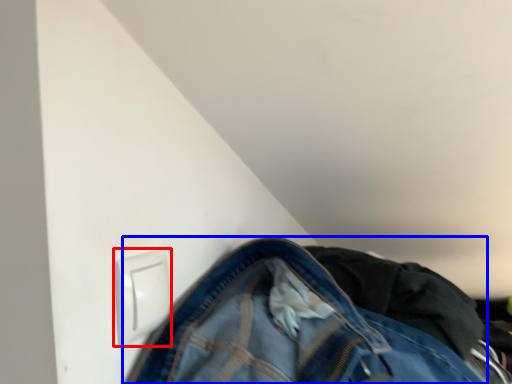
Question: Among these objects, which one is farthest to the camera, electric outlet (highlighted by a red box) or trousers (highlighted by a blue box)?

Choices:
 (A) electric outlet
 (B) trousers

Answer: (B)